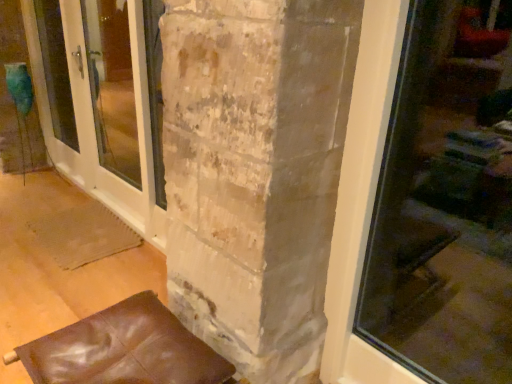
Locate an element on the screen. vacant space situated above leather cushion at lower left (from a real-world perspective) is located at coordinates click(138, 335).